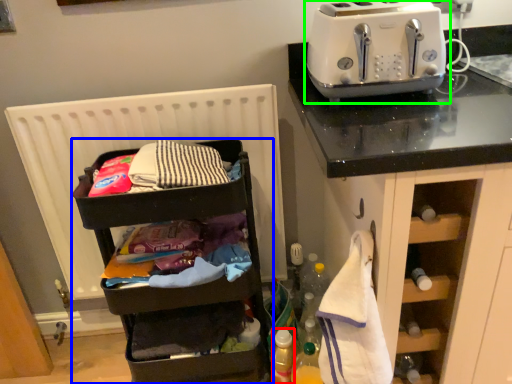
Question: Based on their relative distances, which object is farther from bottle (highlighted by a red box)? Choose from shelf (highlighted by a blue box) and toaster (highlighted by a green box).

Choices:
 (A) shelf
 (B) toaster

Answer: (B)